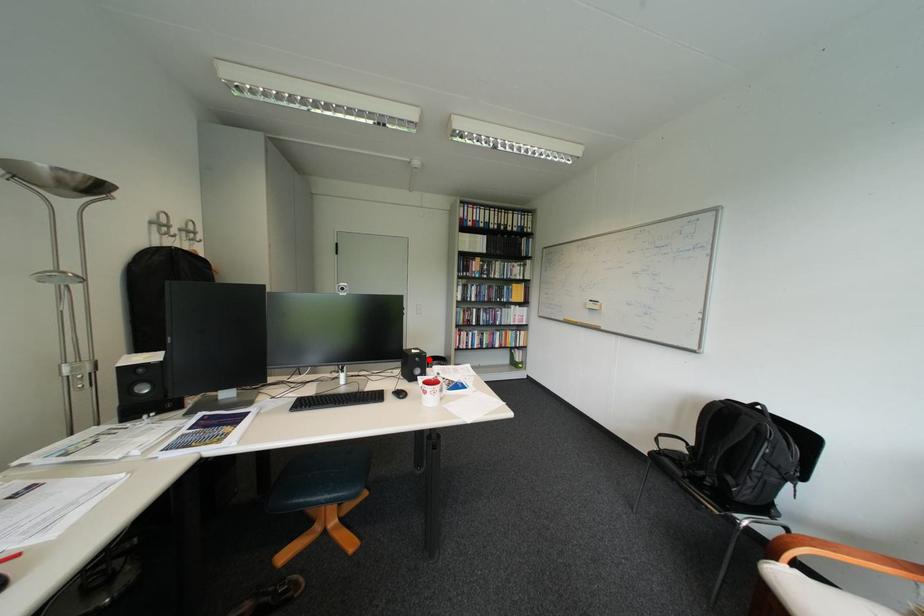
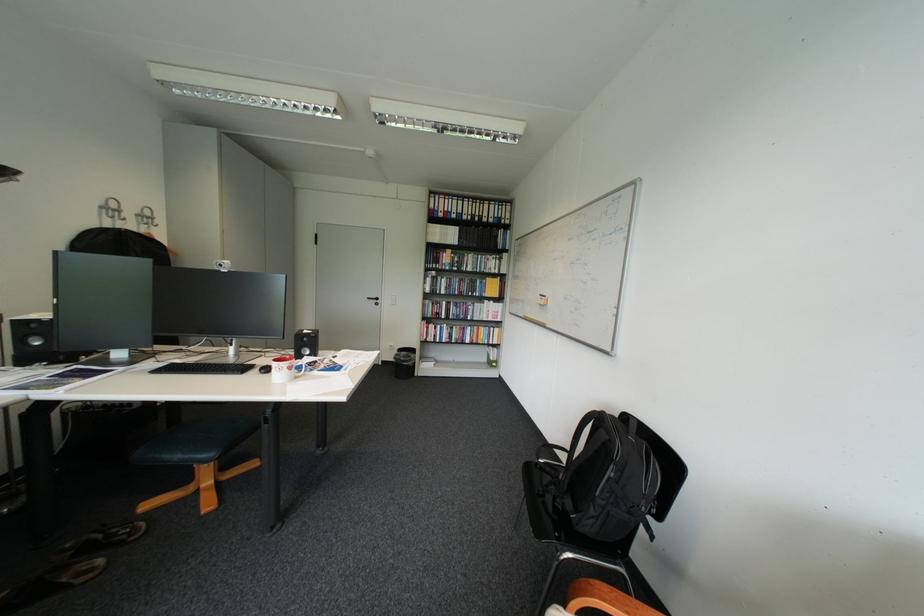
Question: I am providing you with two images of the same scene from different viewpoints. A red point is marked on the first image. Is the red point's position out of view in image 2?

Choices:
 (A) Yes
 (B) No

Answer: (B)